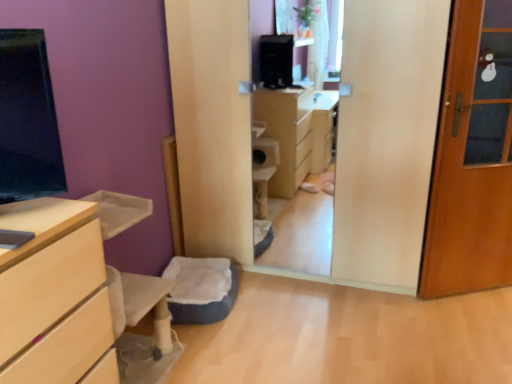
This screenshot has width=512, height=384. What do you see at coordinates (471, 163) in the screenshot? I see `wooden door at right` at bounding box center [471, 163].

Identify the location of wooden door at right. Image resolution: width=512 pixels, height=384 pixels. (471, 163).

Is soft gray cushion at lower center in front of or behind wooden door at right in the image?

Clearly, soft gray cushion at lower center is behind wooden door at right.

From a real-world perspective, does soft gray cushion at lower center stand above wooden door at right?

No, from a real-world perspective, soft gray cushion at lower center is not on top of wooden door at right.

Could you tell me if soft gray cushion at lower center is turned towards wooden door at right?

No, soft gray cushion at lower center does not turn towards wooden door at right.

Can you tell me how much soft gray cushion at lower center and wooden door at right differ in facing direction?

They differ by 71.5 degrees in their facing directions.

From the image's perspective, which is above, soft gray cushion at lower center or light wood chest of drawers at left?

From the image's view, light wood chest of drawers at left is above.

Does soft gray cushion at lower center come in front of light wood chest of drawers at left?

That is False.

Is soft gray cushion at lower center not near light wood chest of drawers at left?

Yes.

From a real-world perspective, is light wood chest of drawers at left located higher than wooden door at right?

No, from a real-world perspective, light wood chest of drawers at left is not above wooden door at right.

From the image's perspective, is light wood chest of drawers at left below wooden door at right?

Correct, light wood chest of drawers at left appears lower than wooden door at right in the image.

Does light wood chest of drawers at left have a greater height compared to wooden door at right?

No, light wood chest of drawers at left is not taller than wooden door at right.

Is wooden door at right oriented away from soft gray cushion at lower center?

That's not correct — wooden door at right is not looking away from soft gray cushion at lower center.

Which is nearer, (507, 28) or (222, 281)?

Point (507, 28) is closer to the camera than point (222, 281).

From the picture: Is wooden door at right located outside soft gray cushion at lower center?

Yes, wooden door at right is located beyond the bounds of soft gray cushion at lower center.

From the image's perspective, is wooden door at right above soft gray cushion at lower center?

Indeed, from the image's perspective, wooden door at right is shown above soft gray cushion at lower center.

Which is more to the right, light wood chest of drawers at left or soft gray cushion at lower center?

soft gray cushion at lower center is more to the right.

Is light wood chest of drawers at left in contact with soft gray cushion at lower center?

No, light wood chest of drawers at left is not making contact with soft gray cushion at lower center.

Considering the relative sizes of light wood chest of drawers at left and soft gray cushion at lower center in the image provided, is light wood chest of drawers at left shorter than soft gray cushion at lower center?

In fact, light wood chest of drawers at left may be taller than soft gray cushion at lower center.

Is wooden door at right wider than light wood chest of drawers at left?

No, wooden door at right is not wider than light wood chest of drawers at left.

From the image's perspective, who appears lower, wooden door at right or light wood chest of drawers at left?

light wood chest of drawers at left, from the image's perspective.

What are the coordinates of `door in front of the soft gray cushion at lower center` in the screenshot? It's located at (471, 163).

Locate an element on the screen. The height and width of the screenshot is (384, 512). chest of drawers on the left of soft gray cushion at lower center is located at coordinates (53, 293).

In the scene shown: Estimate the real-world distances between objects in this image. Which object is further from soft gray cushion at lower center, wooden door at right or light wood chest of drawers at left?

wooden door at right is further to soft gray cushion at lower center.

From the image, which object appears to be farther from wooden door at right, soft gray cushion at lower center or light wood chest of drawers at left?

Based on the image, light wood chest of drawers at left appears to be further to wooden door at right.

Based on their spatial positions, is light wood chest of drawers at left or wooden door at right closer to soft gray cushion at lower center?

light wood chest of drawers at left is closer to soft gray cushion at lower center.

Considering their positions, is soft gray cushion at lower center positioned further to light wood chest of drawers at left than wooden door at right?

wooden door at right is further to light wood chest of drawers at left.

Looking at the image, which one is located further to wooden door at right, light wood chest of drawers at left or soft gray cushion at lower center?

light wood chest of drawers at left is positioned further to the anchor wooden door at right.

Based on their spatial positions, is wooden door at right or soft gray cushion at lower center closer to light wood chest of drawers at left?

Based on the image, soft gray cushion at lower center appears to be nearer to light wood chest of drawers at left.

Where is `flat situated between light wood chest of drawers at left and wooden door at right from left to right`? This screenshot has width=512, height=384. flat situated between light wood chest of drawers at left and wooden door at right from left to right is located at coordinates (201, 289).